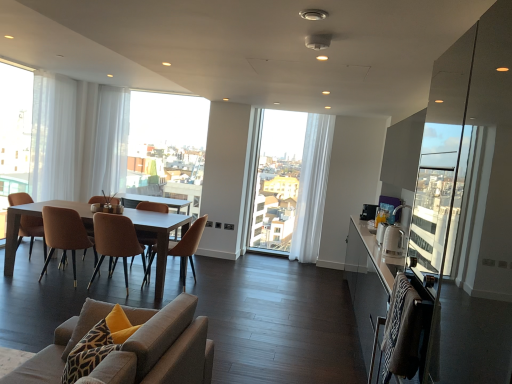
Question: Is point (70, 188) closer or farther from the camera than point (311, 163)?

Choices:
 (A) closer
 (B) farther

Answer: (B)

Question: In terms of width, does white sheer curtain at left, arranged as the first curtain when viewed from the left, look wider or thinner when compared to white sheer curtain at center, placed as the 3th curtain when sorted from left to right?

Choices:
 (A) thin
 (B) wide

Answer: (A)

Question: Considering the real-world distances, which object is closest to the matte brown chair at left, which is the 5th chair from front to back?

Choices:
 (A) brown leather chair at center, the 2th chair when ordered from back to front
 (B) textured beige sofa at lower left, which appears as the first chair when viewed from the front
 (C) white sheer curtain at left, acting as the 2th window screen starting from the right
 (D) matte wooden table at center
 (E) white sheer curtain at center, placed as the 3th curtain when sorted from left to right

Answer: (D)

Question: Considering the real-world distances, which object is farthest from the white sheer curtain at left, acting as the 1th window screen starting from the front?

Choices:
 (A) matte brown chair at left, the first chair positioned from the back
 (B) brown fabric chair at center, the 3th chair viewed from the front
 (C) textured beige sofa at lower left, which appears as the first chair when viewed from the front
 (D) white sheer curtain at upper left, the first window screen in the right-to-left sequence
 (E) matte wooden table at center

Answer: (C)